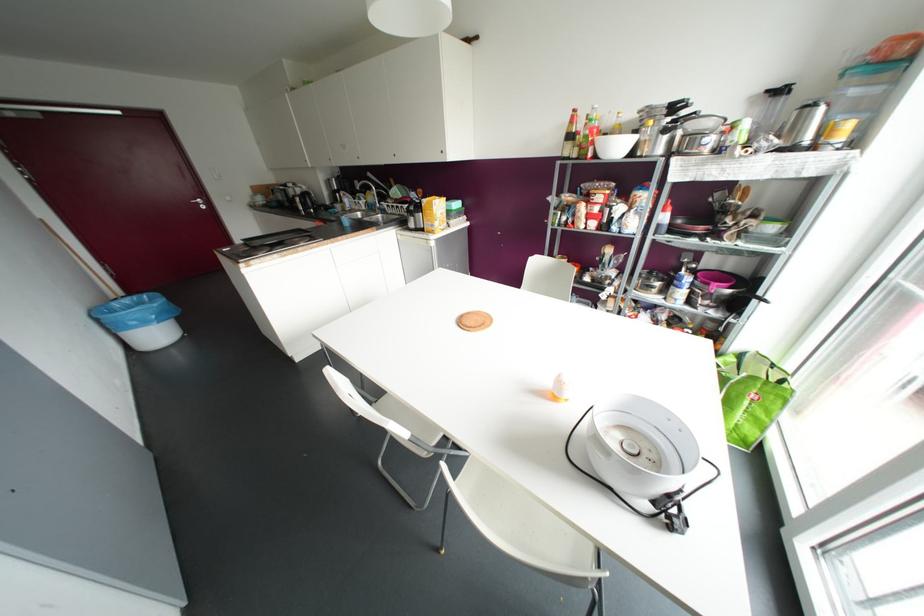
The height and width of the screenshot is (616, 924). Identify the location of green tote bag. (750, 395).